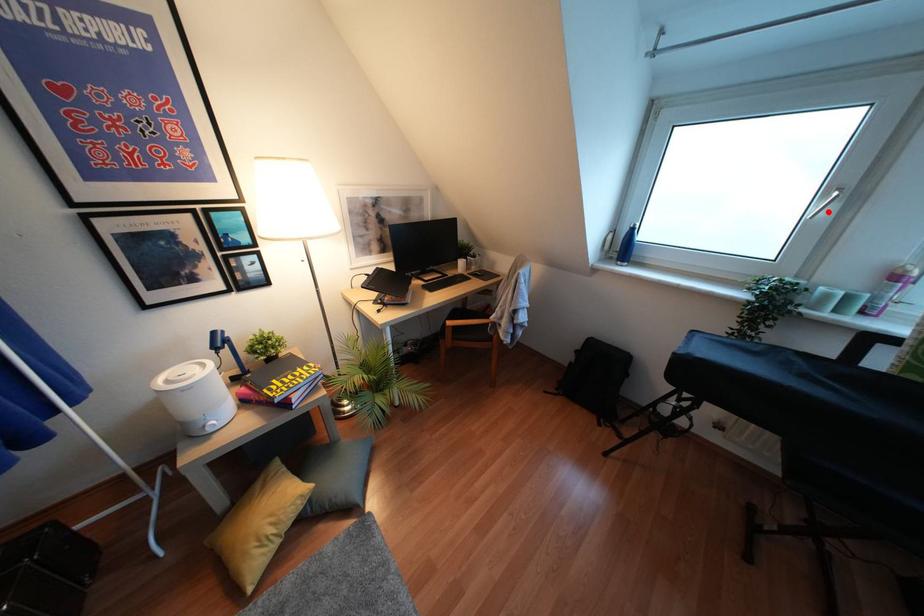
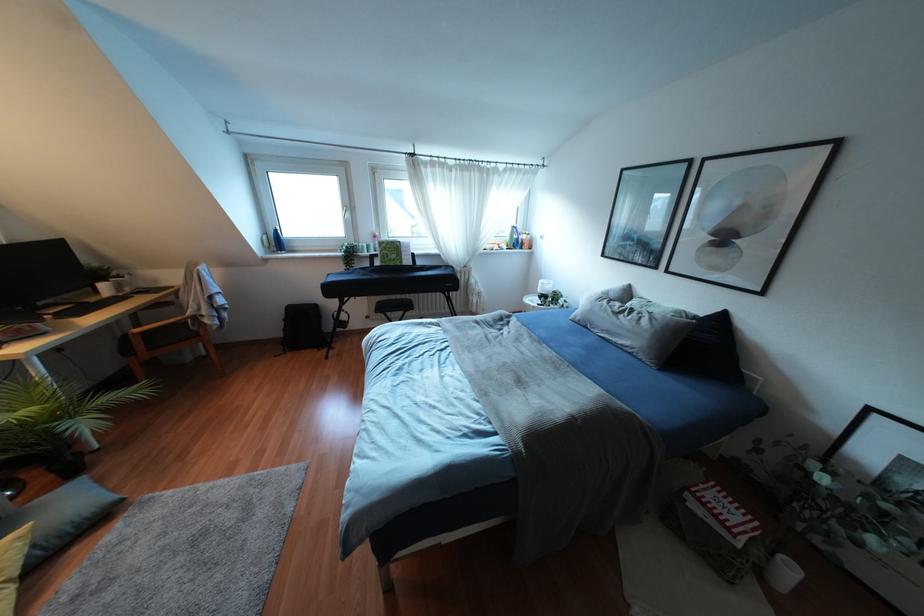
Question: I am providing you with two images of the same scene from different viewpoints. A red point is shown in image1. For the corresponding object point in image2, is it positioned nearer or farther from the camera?

Choices:
 (A) Nearer
 (B) Farther

Answer: (A)